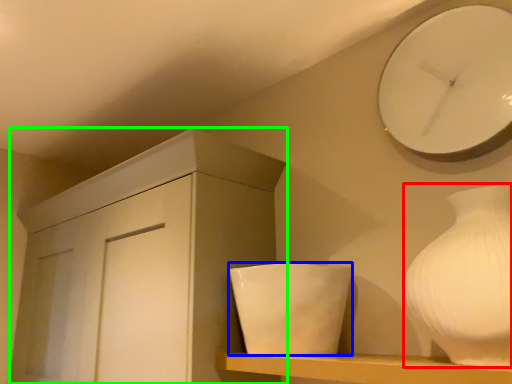
Question: Which object is positioned farthest from vase (highlighted by a red box)? Select from ceramic (highlighted by a blue box) and cabinetry (highlighted by a green box).

Choices:
 (A) ceramic
 (B) cabinetry

Answer: (B)